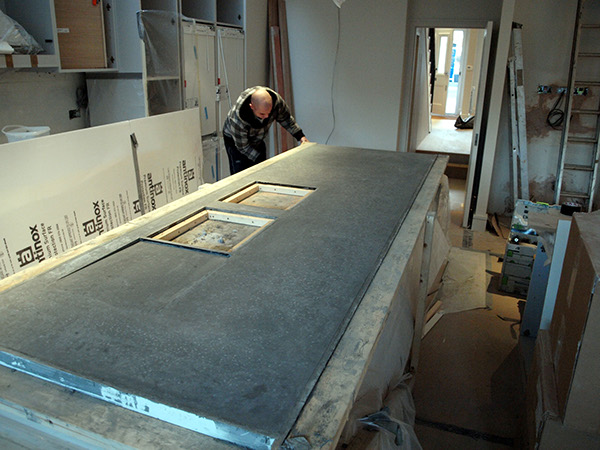
Locate an element on the screen. Image resolution: width=600 pixels, height=450 pixels. floor area is located at coordinates (462, 357), (588, 418), (457, 181).